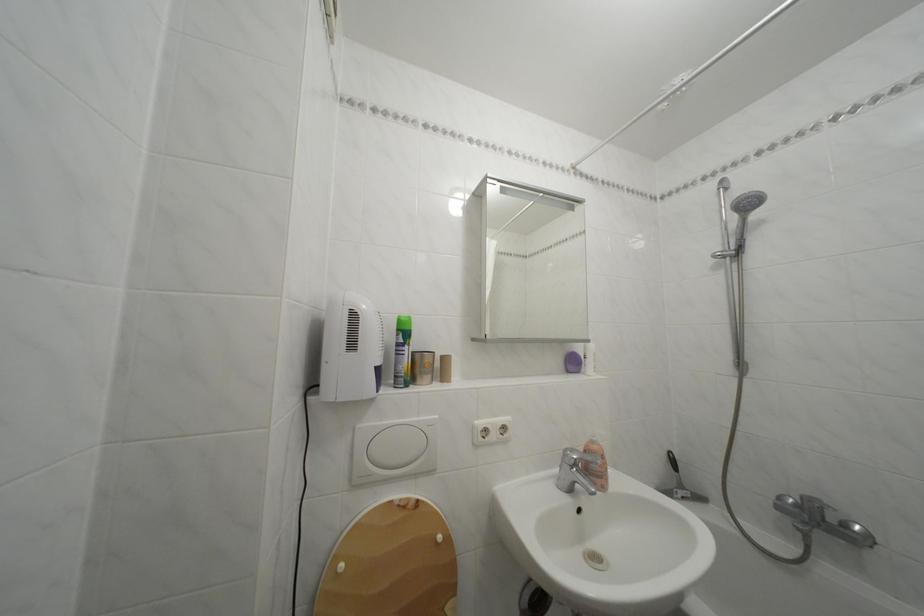
Where would you pull the faucet diverter? Please return your answer as a coordinate pair (x, y).

(576, 469)